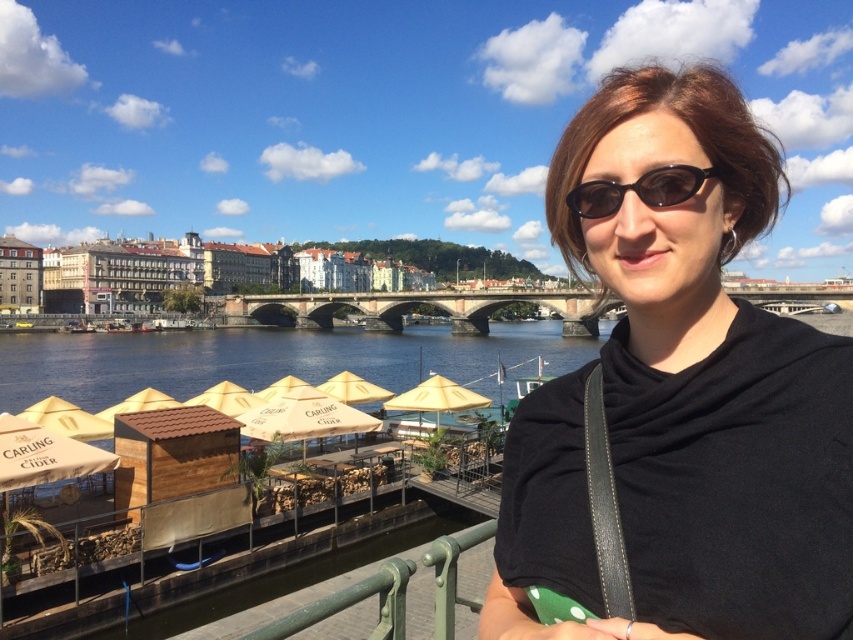
Which is in front, point (816, 365) or point (236, 316)?

Point (816, 365) is in front.

Does black matte shirt at upper right appear on the right side of stone bridge at center?

Correct, you'll find black matte shirt at upper right to the right of stone bridge at center.

Locate an element on the screen. This screenshot has width=853, height=640. black matte shirt at upper right is located at coordinates (682, 397).

Which is above, black matte shirt at upper right or green matte railing at lower center?

black matte shirt at upper right

Does point (750, 358) come behind point (397, 636)?

No, it is in front of (397, 636).

What are the coordinates of `black matte shirt at upper right` in the screenshot? It's located at (682, 397).

In the scene shown: Can you confirm if stone bridge at center is positioned to the right of green matte railing at lower center?

In fact, stone bridge at center is to the left of green matte railing at lower center.

Describe the element at coordinates (412, 308) in the screenshot. I see `stone bridge at center` at that location.

Where is `stone bridge at center`? stone bridge at center is located at coordinates (412, 308).